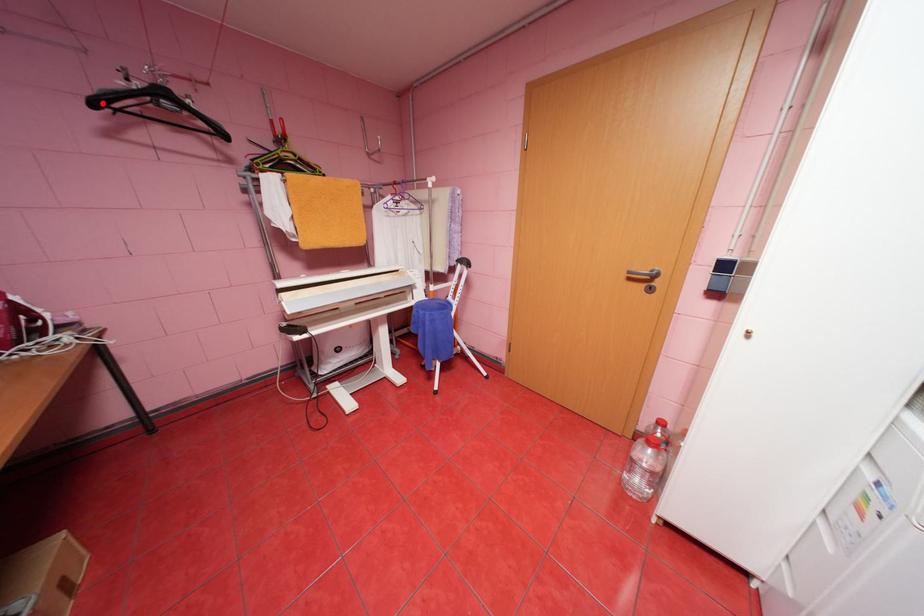
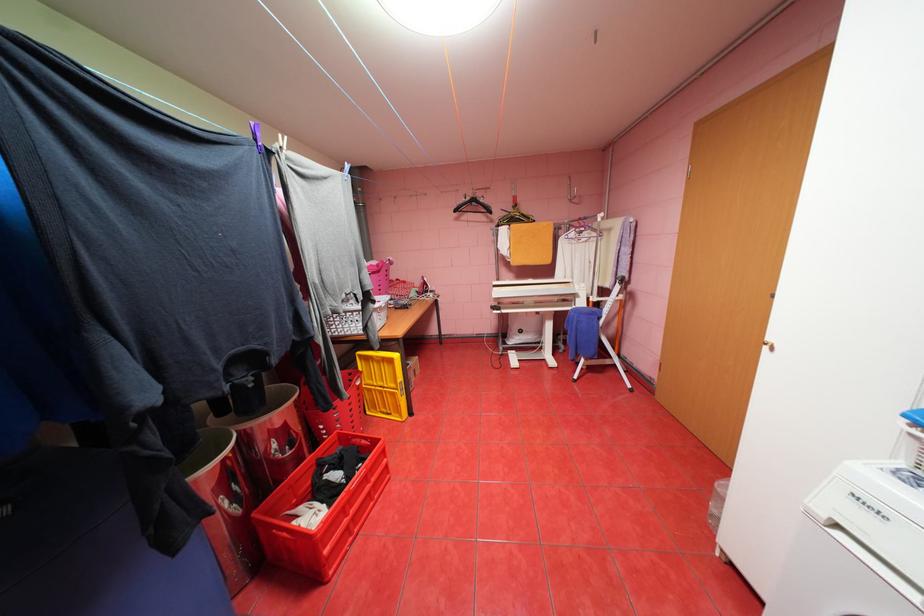
Where in the second image is the point corresponding to the highlighted location from the first image?

(464, 209)